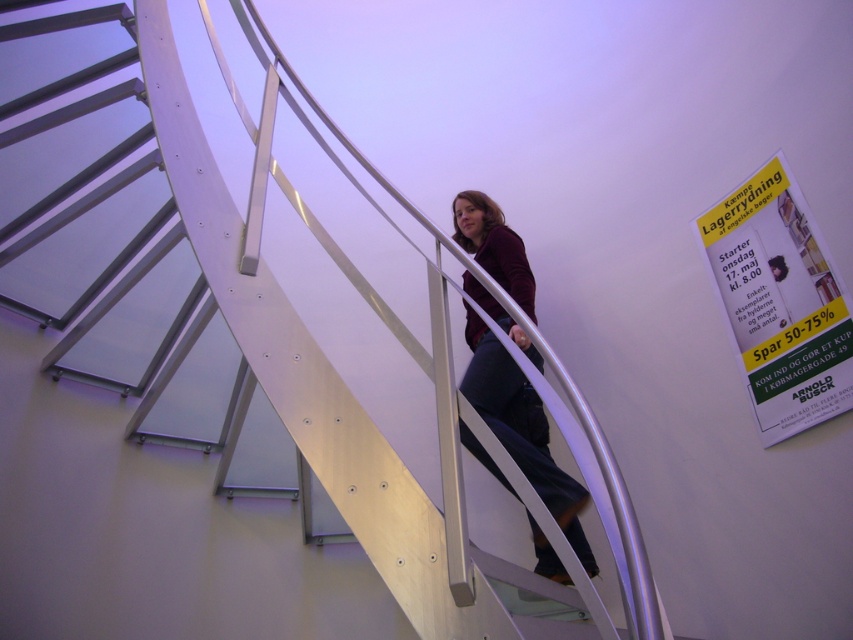
Question: From the image, what is the correct spatial relationship of yellow paper poster at upper right in relation to matte maroon sweater at center?

Choices:
 (A) below
 (B) above

Answer: (B)

Question: Does yellow paper poster at upper right lie in front of matte maroon sweater at center?

Choices:
 (A) no
 (B) yes

Answer: (B)

Question: Which point is closer to the camera?

Choices:
 (A) matte maroon sweater at center
 (B) yellow paper poster at upper right

Answer: (B)

Question: Among these objects, which one is farthest from the camera?

Choices:
 (A) matte maroon sweater at center
 (B) yellow paper poster at upper right

Answer: (A)

Question: In this image, where is yellow paper poster at upper right located relative to matte maroon sweater at center?

Choices:
 (A) left
 (B) right

Answer: (B)

Question: Which point appears farthest from the camera in this image?

Choices:
 (A) (773, 236)
 (B) (532, 308)

Answer: (B)